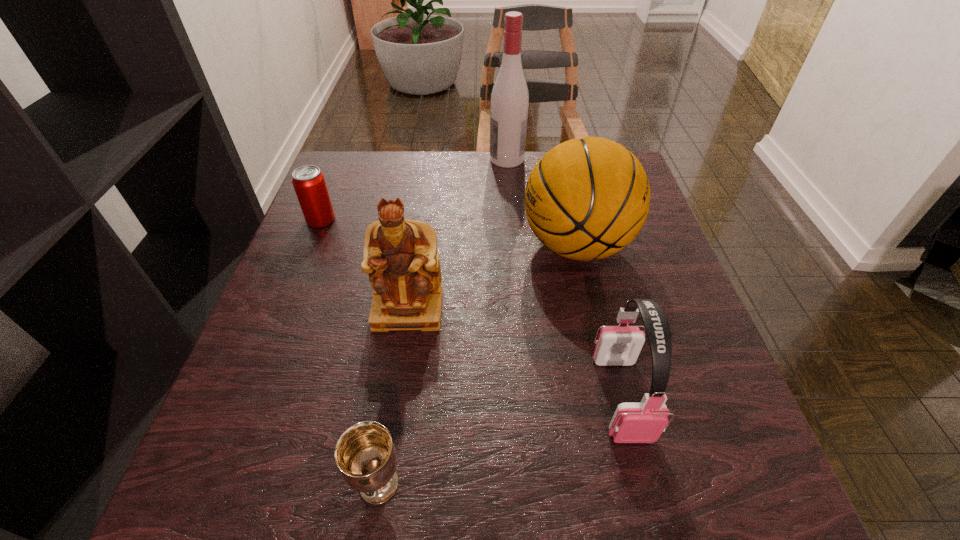
Choose which object is the second nearest neighbor to the fourth farthest object. Please provide its 2D coordinates. Your answer should be formatted as a tuple, i.e. [(x, y)], where the tuple contains the x and y coordinates of a point satisfying the conditions above.

[(309, 183)]

Where is `vacant area that satisfies the following two spatial constraints: 1. on the surface of the basketball near the brand logo; 2. on the front side of the chalice`? The width and height of the screenshot is (960, 540). vacant area that satisfies the following two spatial constraints: 1. on the surface of the basketball near the brand logo; 2. on the front side of the chalice is located at coordinates (631, 484).